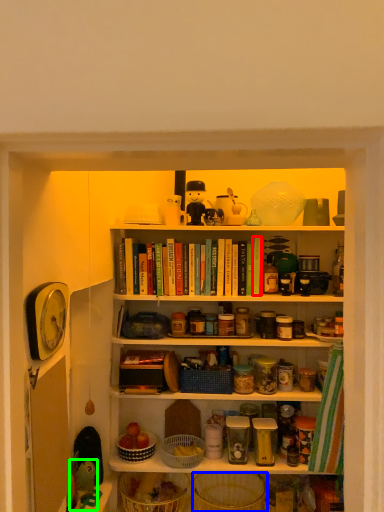
Question: Which is nearer to the book (highlighted by a red box)? basket (highlighted by a blue box) or toy (highlighted by a green box).

Choices:
 (A) basket
 (B) toy

Answer: (B)